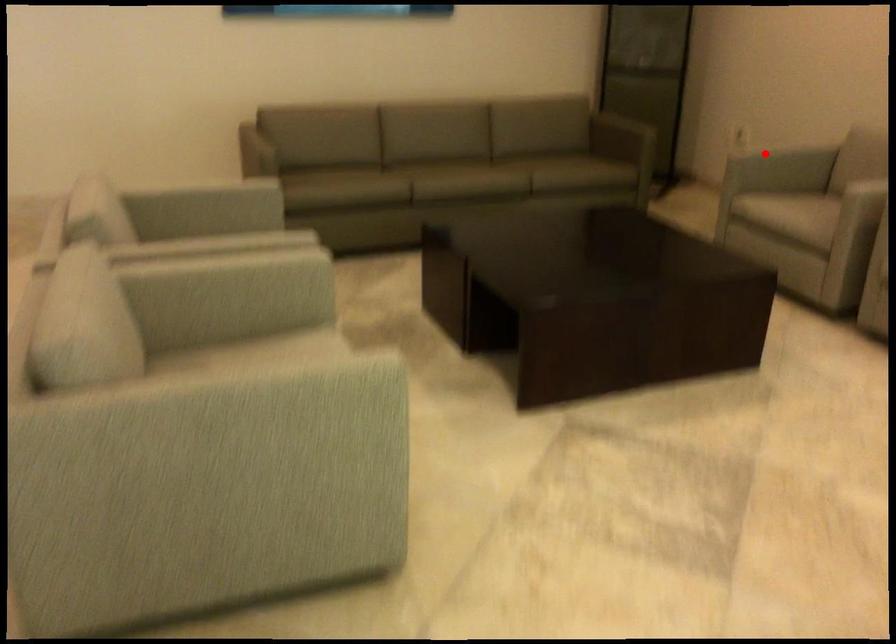
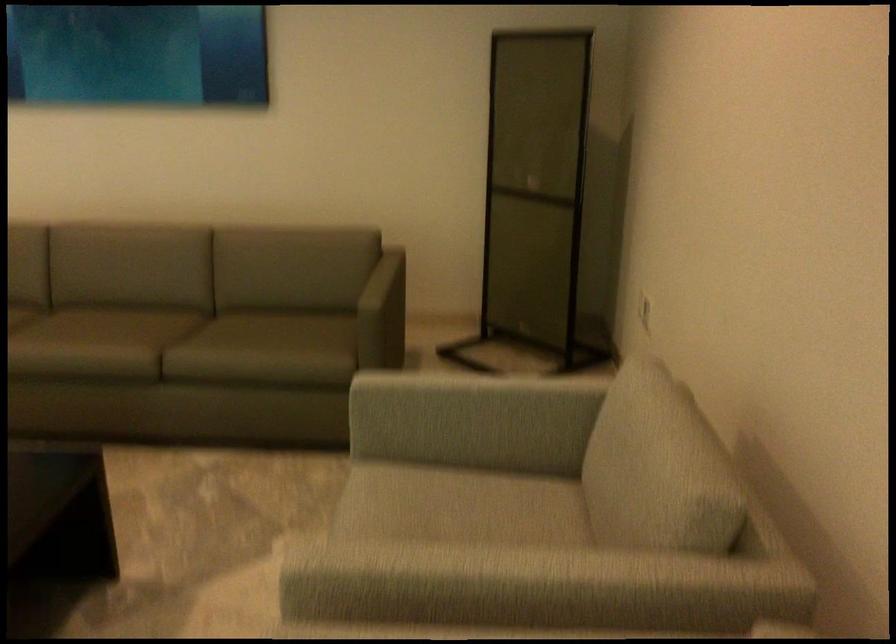
Locate, in the second image, the point that corresponds to the highlighted location in the first image.

(469, 399)